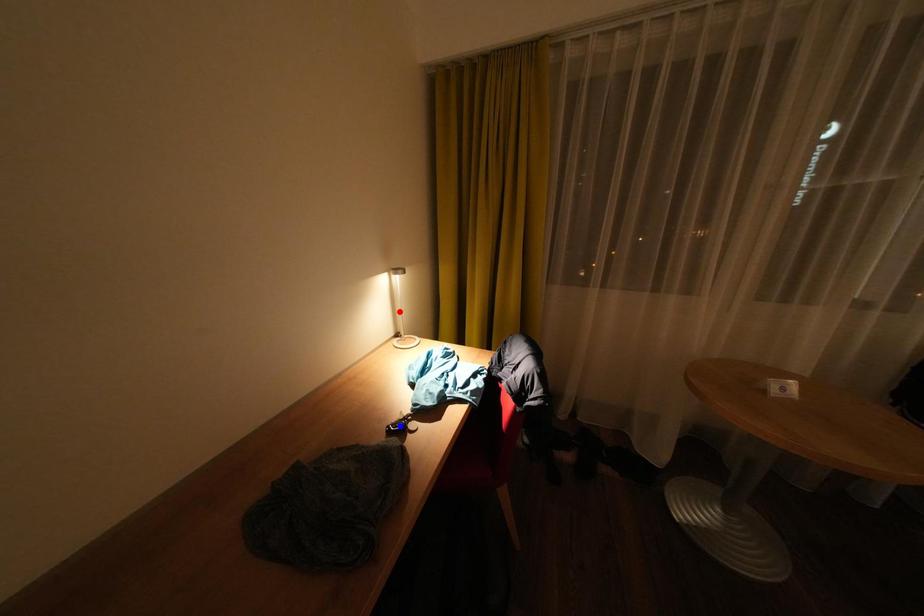
Question: In the image, two points are highlighted. Which point is nearer to the camera? Reply with the corresponding letter.

Choices:
 (A) blue point
 (B) red point

Answer: (A)